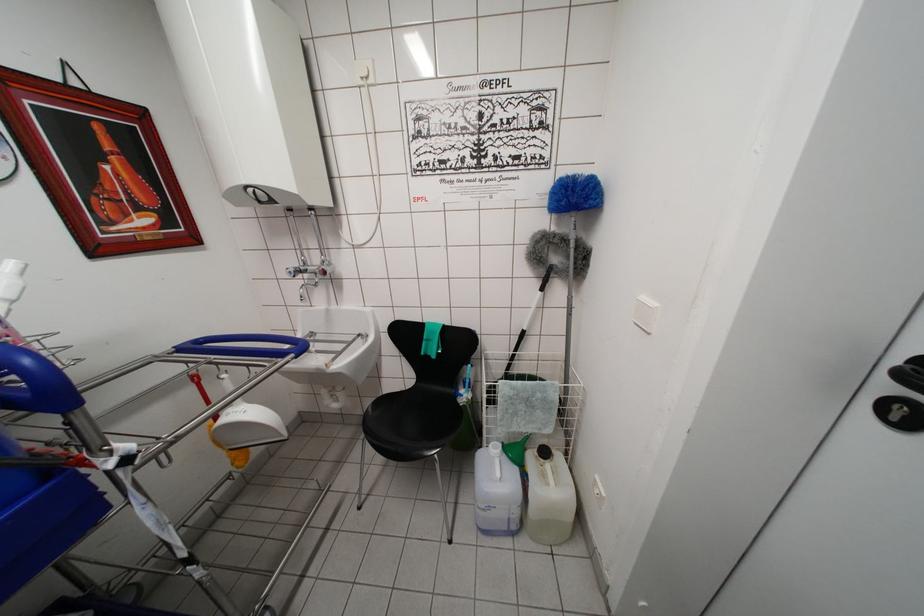
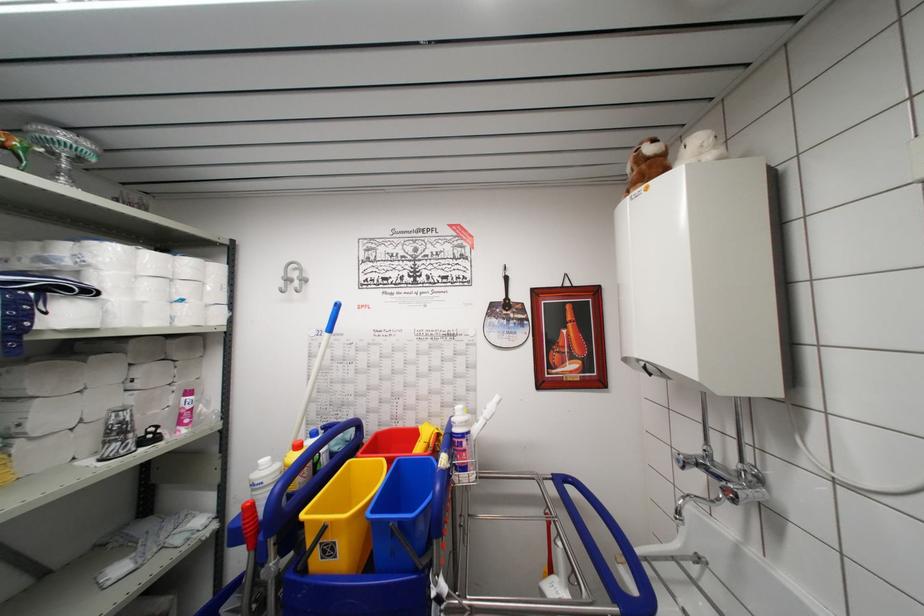
In the second image, find the point that corresponds to pixel 179 360 in the first image.

(554, 487)